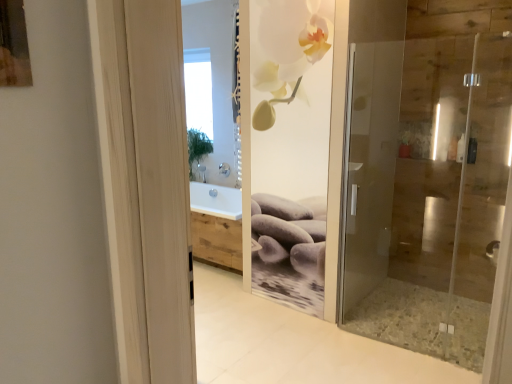
Question: From the image's perspective, is transparent glass shower door at right on top of transparent glass window at upper center?

Choices:
 (A) yes
 (B) no

Answer: (B)

Question: From the image's perspective, is transparent glass shower door at right below transparent glass window at upper center?

Choices:
 (A) yes
 (B) no

Answer: (A)

Question: From a real-world perspective, is transparent glass shower door at right on top of transparent glass window at upper center?

Choices:
 (A) yes
 (B) no

Answer: (B)

Question: Is transparent glass window at upper center surrounded by transparent glass shower door at right?

Choices:
 (A) yes
 (B) no

Answer: (B)

Question: Considering the relative sizes of transparent glass shower door at right and transparent glass window at upper center in the image provided, is transparent glass shower door at right bigger than transparent glass window at upper center?

Choices:
 (A) yes
 (B) no

Answer: (A)

Question: From a real-world perspective, is transparent glass shower door at right under transparent glass window at upper center?

Choices:
 (A) yes
 (B) no

Answer: (A)

Question: Can you confirm if transparent glass window at upper center is positioned to the left of transparent glass shower door at right?

Choices:
 (A) no
 (B) yes

Answer: (B)

Question: Is transparent glass window at upper center wider than transparent glass shower door at right?

Choices:
 (A) no
 (B) yes

Answer: (A)

Question: Could you tell me if transparent glass window at upper center is turned towards transparent glass shower door at right?

Choices:
 (A) no
 (B) yes

Answer: (A)

Question: From a real-world perspective, is transparent glass window at upper center over transparent glass shower door at right?

Choices:
 (A) no
 (B) yes

Answer: (B)

Question: From a real-world perspective, is transparent glass window at upper center physically below transparent glass shower door at right?

Choices:
 (A) no
 (B) yes

Answer: (A)

Question: From the image's perspective, is transparent glass window at upper center on transparent glass shower door at right?

Choices:
 (A) yes
 (B) no

Answer: (A)

Question: From the image's perspective, is transparent glass window at upper center located above or below transparent glass shower door at right?

Choices:
 (A) above
 (B) below

Answer: (A)